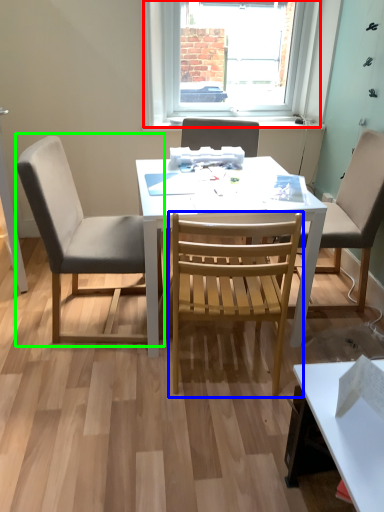
Question: Considering the real-world distances, which object is farthest from window (highlighted by a red box)? chair (highlighted by a blue box) or chair (highlighted by a green box)?

Choices:
 (A) chair
 (B) chair

Answer: (A)